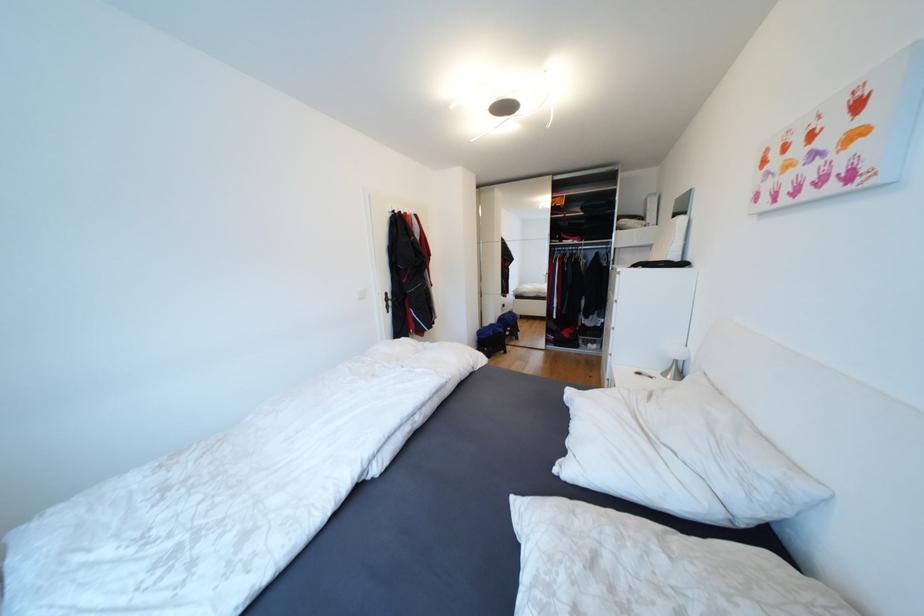
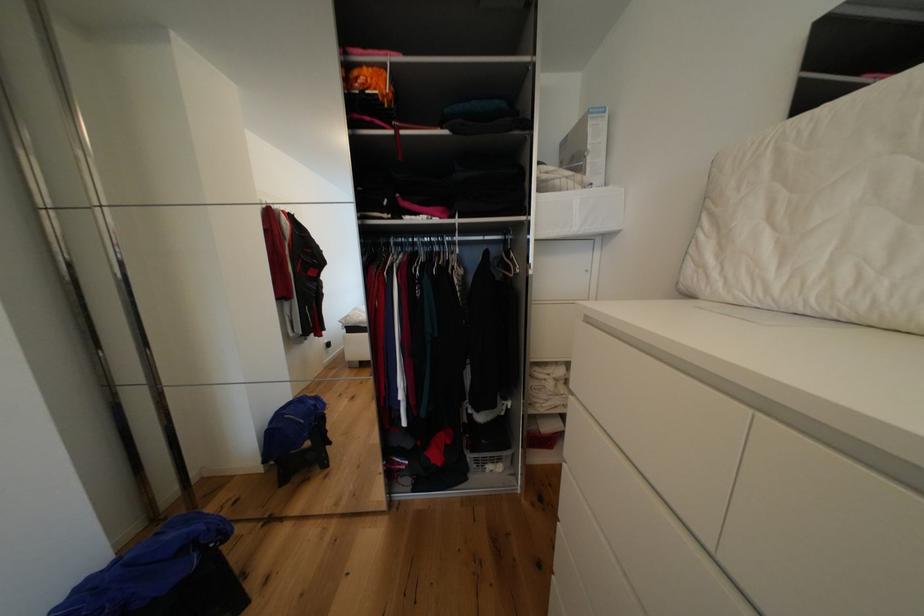
In a continuous first-person perspective shot, in which direction is the camera moving?

The cameraman walked toward right, forward.